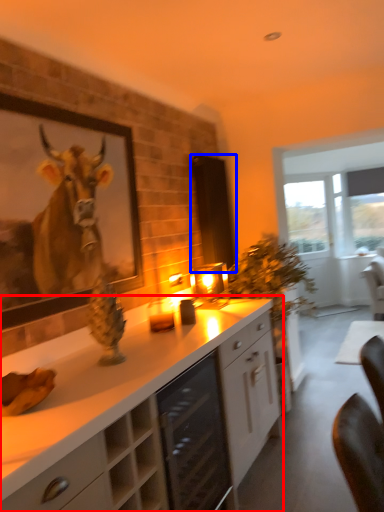
Question: Among these objects, which one is farthest to the camera, cabinetry (highlighted by a red box) or screen door (highlighted by a blue box)?

Choices:
 (A) cabinetry
 (B) screen door

Answer: (B)